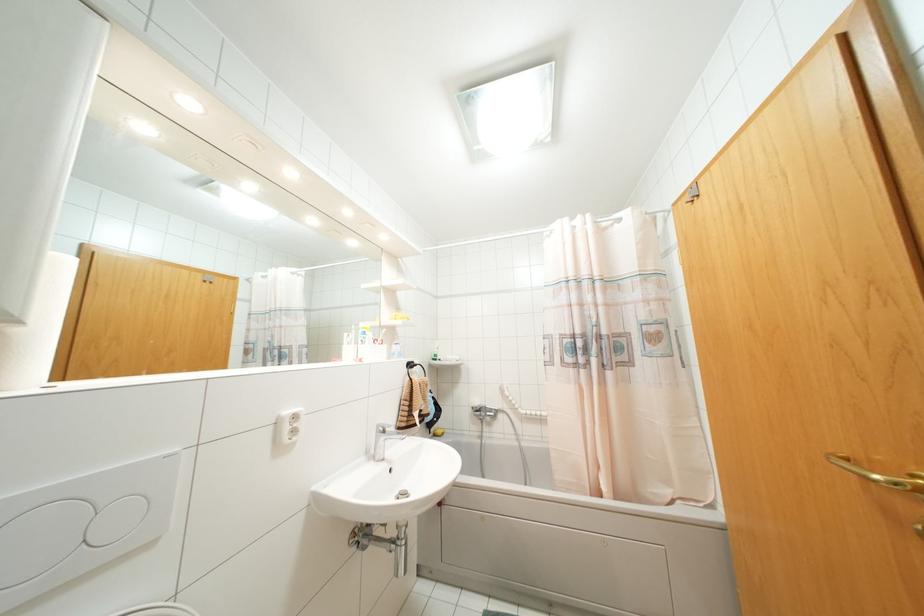
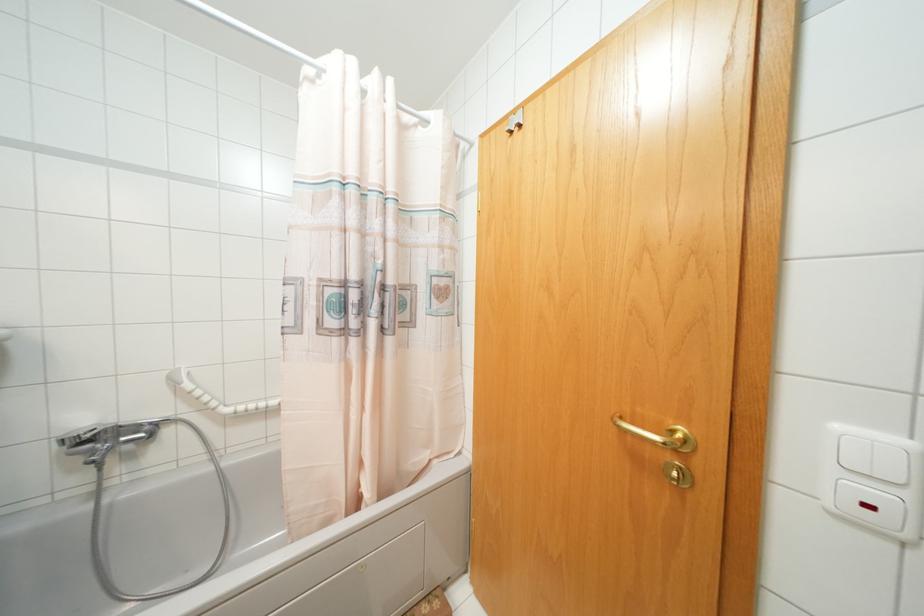
The point at (478, 410) is marked in the first image. Where is the corresponding point in the second image?

(84, 440)